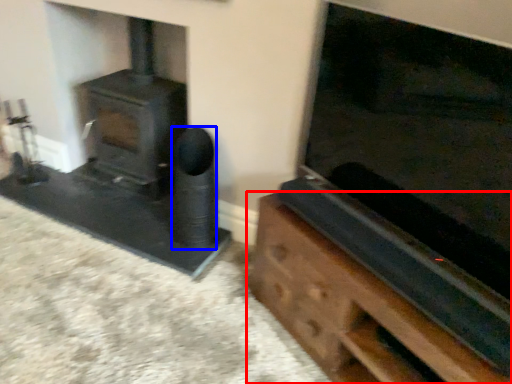
Question: Which object appears farthest to the camera in this image, furniture (highlighted by a red box) or speaker (highlighted by a blue box)?

Choices:
 (A) furniture
 (B) speaker

Answer: (B)